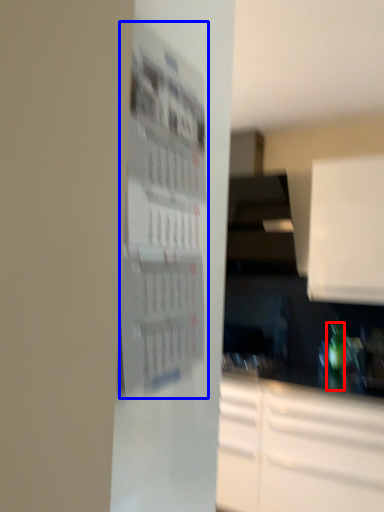
Question: Which of the following is the farthest to the observer, bottle (highlighted by a red box) or bulletin board (highlighted by a blue box)?

Choices:
 (A) bottle
 (B) bulletin board

Answer: (A)